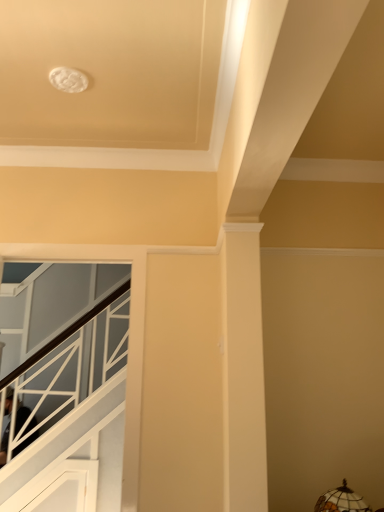
Question: Considering the positions of white glossy stairwell at left and stained glass lampshade at lower right in the image, is white glossy stairwell at left bigger or smaller than stained glass lampshade at lower right?

Choices:
 (A) big
 (B) small

Answer: (A)

Question: From the image's perspective, is white glossy stairwell at left above or below stained glass lampshade at lower right?

Choices:
 (A) below
 (B) above

Answer: (A)

Question: Is white glossy stairwell at left wider or thinner than stained glass lampshade at lower right?

Choices:
 (A) thin
 (B) wide

Answer: (A)

Question: Does point (342, 484) appear closer or farther from the camera than point (97, 396)?

Choices:
 (A) farther
 (B) closer

Answer: (B)

Question: In terms of height, does stained glass lampshade at lower right look taller or shorter compared to white glossy stairwell at left?

Choices:
 (A) short
 (B) tall

Answer: (A)

Question: From a real-world perspective, is stained glass lampshade at lower right physically located above or below white glossy stairwell at left?

Choices:
 (A) above
 (B) below

Answer: (B)

Question: From the image's perspective, is stained glass lampshade at lower right located above or below white glossy stairwell at left?

Choices:
 (A) below
 (B) above

Answer: (B)